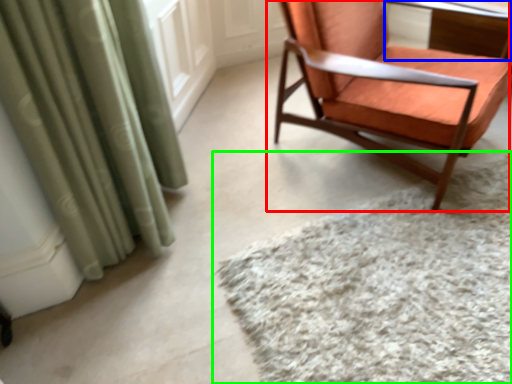
Question: Which object is positioned closest to chair (highlighted by a red box)? Select from table (highlighted by a blue box) and mat (highlighted by a green box).

Choices:
 (A) table
 (B) mat

Answer: (B)